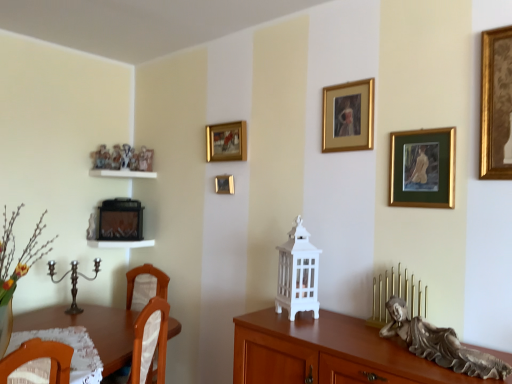
Question: Which is correct: white glossy shelf at center, which ranks as the second shelf in top-to-bottom order, is inside polished silver candle holder at lower left, arranged as the 1th candle holder when viewed from the left, or outside of it?

Choices:
 (A) inside
 (B) outside

Answer: (B)

Question: From a real-world perspective, is white glossy shelf at center, arranged as the first shelf when ordered from the bottom, physically located above or below polished silver candle holder at lower left, the 2th candle holder in the front-to-back sequence?

Choices:
 (A) below
 (B) above

Answer: (B)

Question: Which of these objects is positioned closest to the gold/glass picture frame at upper right, arranged as the 4th picture frame when viewed from the left?

Choices:
 (A) bronze statue at lower right
 (B) white glossy shelf at upper left, the first shelf in the top-to-bottom sequence
 (C) brown wooden desk at lower left
 (D) white glossy shelf at center, which ranks as the second shelf in top-to-bottom order
 (E) gold/glossy picture frame at upper center, acting as the second picture frame starting from the back

Answer: (A)

Question: Estimate the real-world distances between objects in this image. Which object is closer to the bronze statue at lower right?

Choices:
 (A) brown wooden desk at lower left
 (B) gold/glossy picture frame at upper center, arranged as the third picture frame when viewed from the right
 (C) gold metallic picture frame at center, the fourth picture frame positioned from the right
 (D) gold-framed painting at upper center, the second picture frame positioned from the right
 (E) gold/glass picture frame at upper right, arranged as the first picture frame when viewed from the right

Answer: (E)